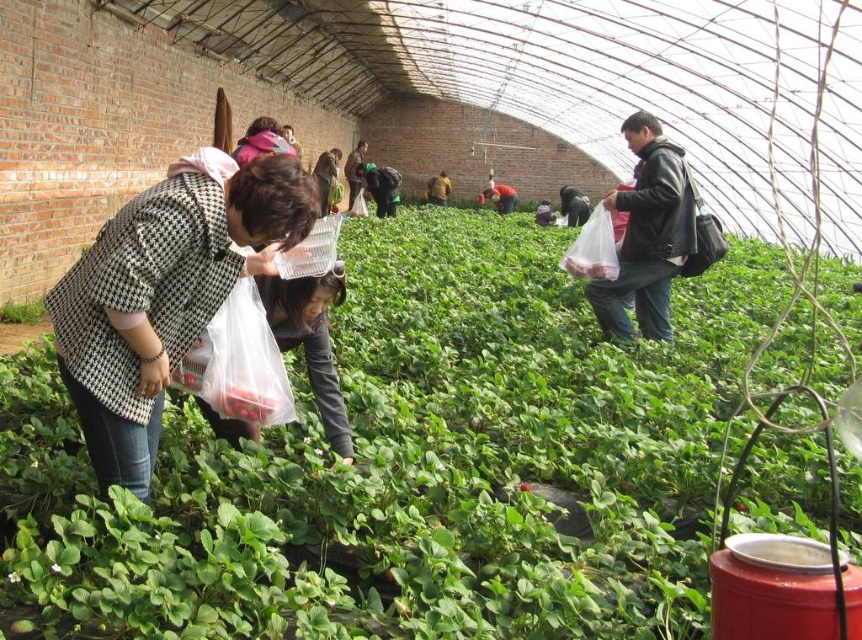
Is green leafy plant at center above patterned fabric coat at center-left?

Yes.

Who is taller, green leafy plant at center or patterned fabric coat at center-left?

green leafy plant at center

The image size is (862, 640). In order to click on green leafy plant at center in this screenshot , I will do `click(411, 461)`.

Who is more forward, (695, 344) or (9, 301)?

Point (695, 344)

Who is more distant from viewer, (x=673, y=397) or (x=41, y=314)?

The point (x=41, y=314) is behind.

Locate an element on the screen. The height and width of the screenshot is (640, 862). green leafy plant at center is located at coordinates (411, 461).

Describe the element at coordinates (163, 298) in the screenshot. I see `patterned fabric coat at center-left` at that location.

Between point (92, 385) and point (39, 301), which one is positioned in front?

Point (92, 385) is in front.

This screenshot has height=640, width=862. In order to click on patterned fabric coat at center-left in this screenshot , I will do `click(163, 298)`.